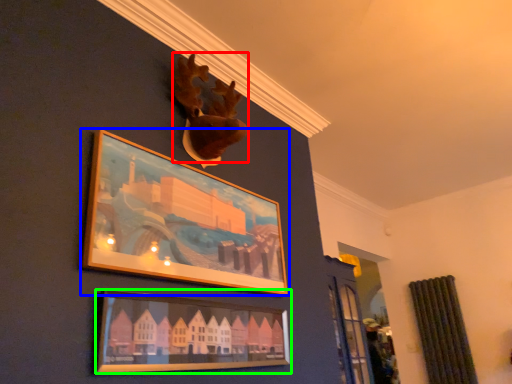
Question: Considering the real-world distances, which object is closest to animal (highlighted by a red box)? picture frame (highlighted by a blue box) or picture frame (highlighted by a green box).

Choices:
 (A) picture frame
 (B) picture frame

Answer: (A)